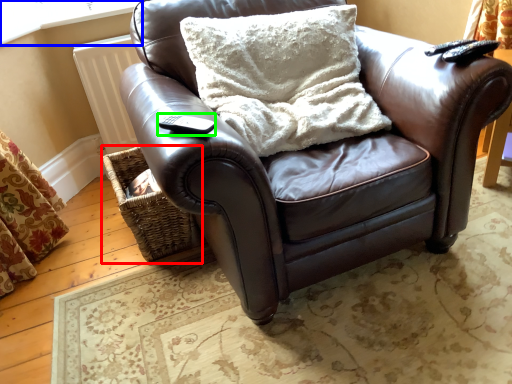
Question: Which object is positioned farthest from basket (highlighted by a red box)? Select from window frame (highlighted by a blue box) and remote (highlighted by a green box).

Choices:
 (A) window frame
 (B) remote

Answer: (A)